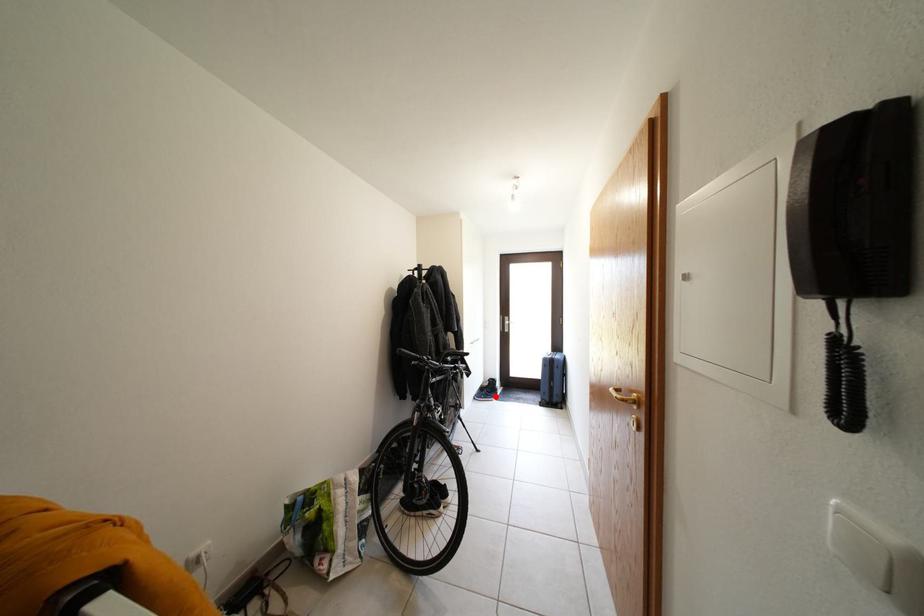
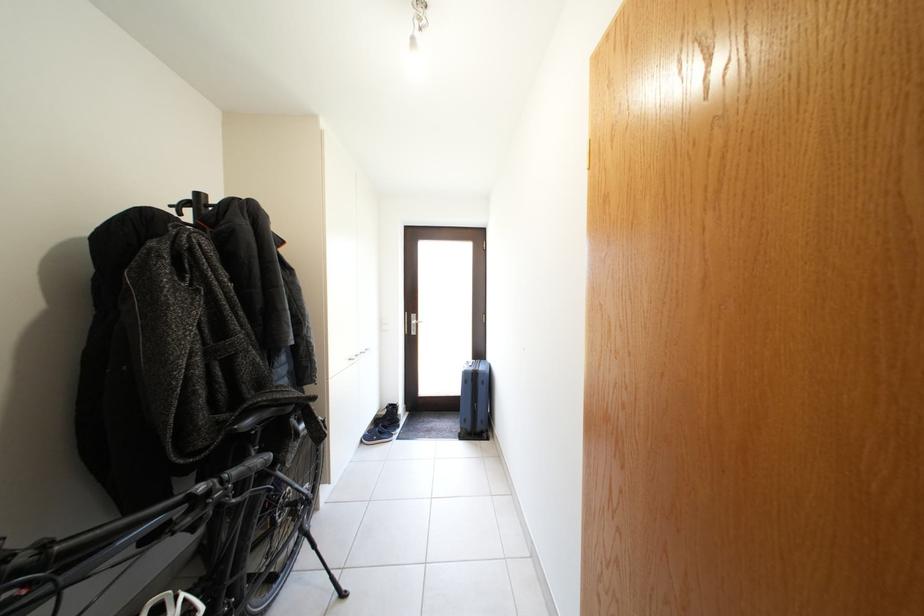
Question: I am providing you with two images of the same scene from different viewpoints. In image1, a red point is highlighted. Considering the same 3D point in image2, which of the following is correct?

Choices:
 (A) It is closer
 (B) It is farther

Answer: (A)